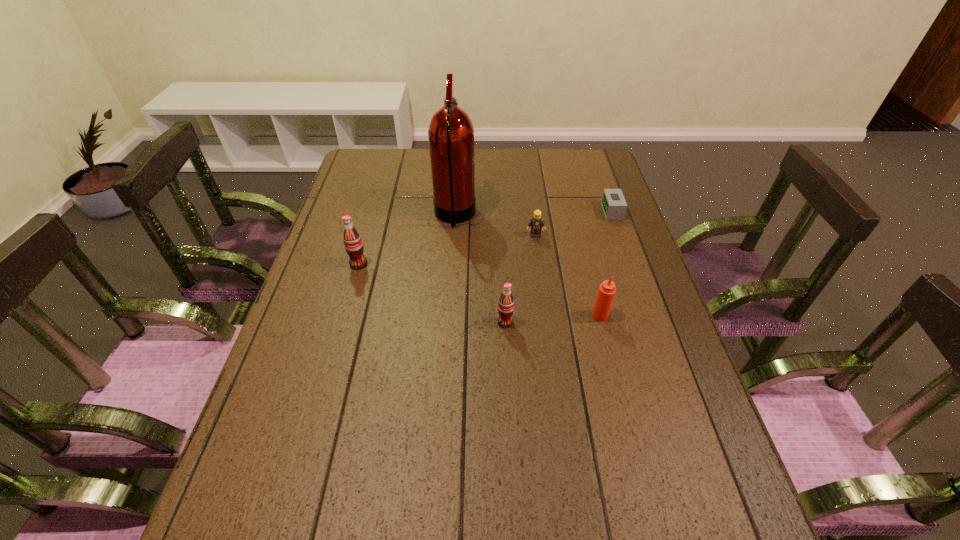
In the current image, all sodas are evenly spaced. To maintain this equal spacing, where should an additional soda be placed on the right? Please point out a free spot. Please provide its 2D coordinates. Your answer should be formatted as a tuple, i.e. [(x, y)], where the tuple contains the x and y coordinates of a point satisfying the conditions above.

[(697, 399)]